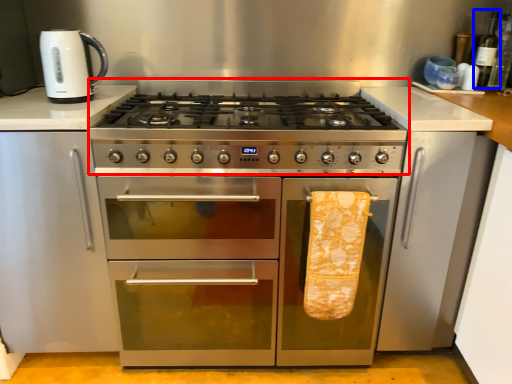
Question: Which object appears closest to the camera in this image, gas stove (highlighted by a red box) or bottle (highlighted by a blue box)?

Choices:
 (A) gas stove
 (B) bottle

Answer: (A)